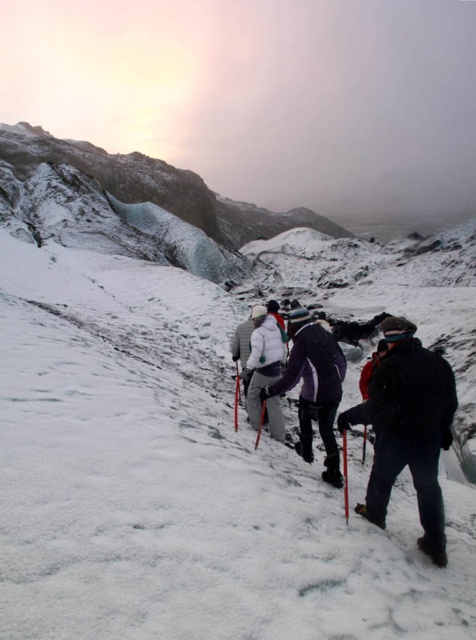
Question: Among these objects, which one is farthest from the camera?

Choices:
 (A) dark blue jacket at lower right
 (B) black matte ski at lower right

Answer: (A)

Question: Where is dark blue jacket at lower right located in relation to black matte ski at lower right in the image?

Choices:
 (A) left
 (B) right

Answer: (A)

Question: Among these points, which one is nearest to the camera?

Choices:
 (A) (423, 545)
 (B) (419, 456)

Answer: (A)

Question: Which object appears farthest from the camera in this image?

Choices:
 (A) black matte ski at lower right
 (B) dark blue jacket at lower right

Answer: (B)

Question: Can you confirm if dark blue jacket at lower right is smaller than black matte ski at lower right?

Choices:
 (A) no
 (B) yes

Answer: (A)

Question: Is dark blue jacket at lower right to the left of black matte ski at lower right from the viewer's perspective?

Choices:
 (A) no
 (B) yes

Answer: (B)